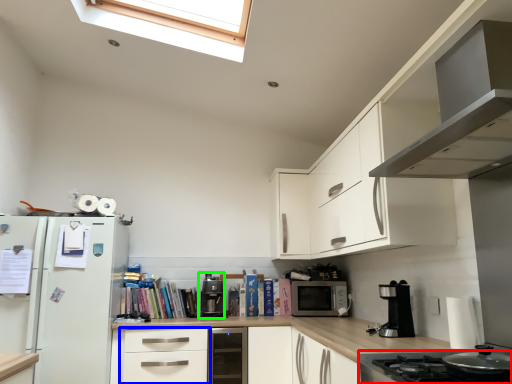
Question: Considering the real-world distances, which object is closest to home appliance (highlighted by a red box)? drawer (highlighted by a blue box) or coffee machine (highlighted by a green box).

Choices:
 (A) drawer
 (B) coffee machine

Answer: (A)